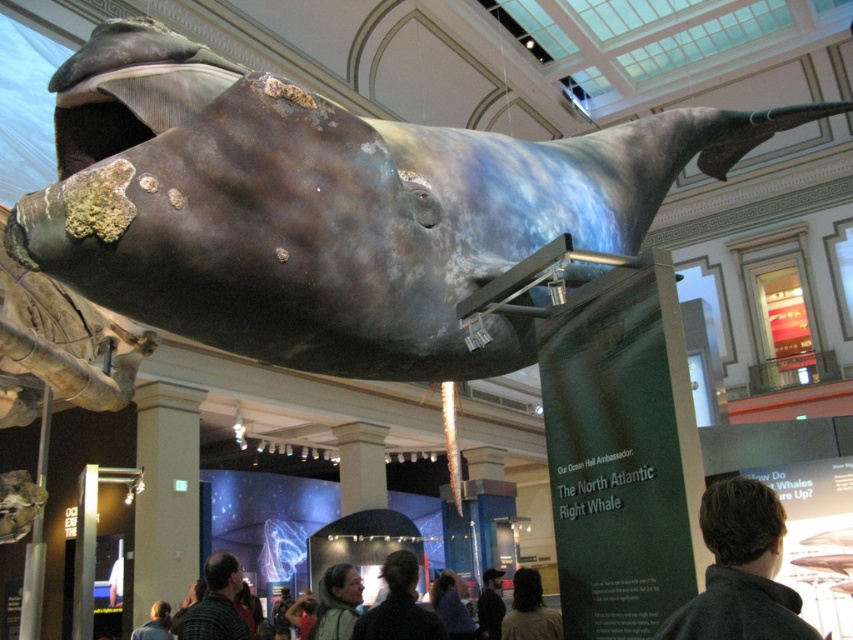
Question: Which of these objects is positioned closest to the shiny dark gray whale at center?

Choices:
 (A) dark gray sweater at lower center
 (B) gray wool sweater at lower center
 (C) dark brown sweater at lower left
 (D) blue-gray fabric jacket at center

Answer: (A)

Question: Does gray wool sweater at lower center lie in front of brown hair at lower center?

Choices:
 (A) no
 (B) yes

Answer: (B)

Question: Can you confirm if dark gray sweater at lower center is positioned to the right of brown hair at lower center?

Choices:
 (A) no
 (B) yes

Answer: (A)

Question: Estimate the real-world distances between objects in this image. Which object is farther from the gray wool sweater at lower center?

Choices:
 (A) dark brown hair at lower center
 (B) dark gray sweater at center
 (C) dark brown sweater at lower left
 (D) brown hair at lower center

Answer: (B)

Question: Observing the image, what is the correct spatial positioning of dark gray sweater at lower center in reference to dark brown hair at center?

Choices:
 (A) above
 (B) below

Answer: (B)

Question: Among these objects, which one is nearest to the camera?

Choices:
 (A) dark brown sweater at lower left
 (B) dark gray sweater at lower center
 (C) dark brown leather jacket at center
 (D) brown hair at lower center

Answer: (B)